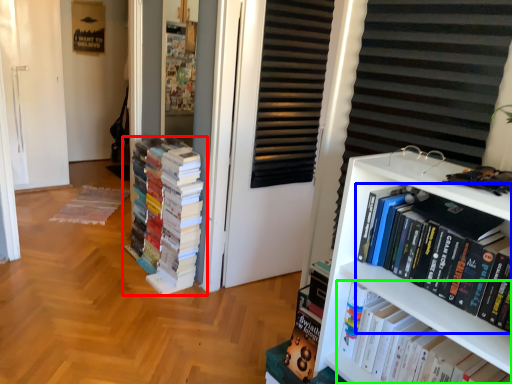
Question: Which object is positioned farthest from book (highlighted by a red box)? Select from book (highlighted by a blue box) and book (highlighted by a green box).

Choices:
 (A) book
 (B) book

Answer: (A)